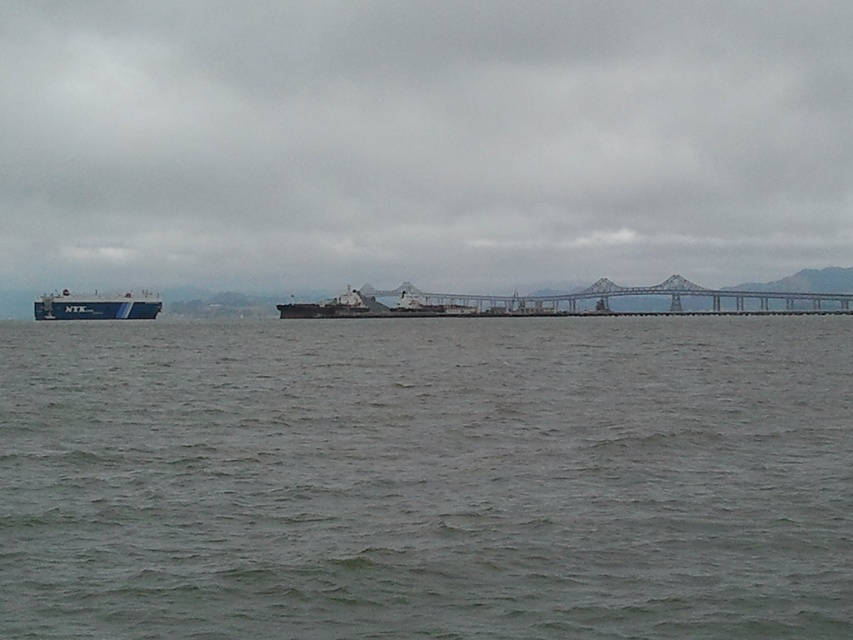
Who is higher up, gray matte water at center or metallic gray bridge at center?

metallic gray bridge at center is above.

Can you confirm if gray matte water at center is positioned below metallic gray bridge at center?

Correct, gray matte water at center is located below metallic gray bridge at center.

Describe the element at coordinates (427, 477) in the screenshot. I see `gray matte water at center` at that location.

This screenshot has height=640, width=853. Find the location of `gray matte water at center`. gray matte water at center is located at coordinates (427, 477).

Is point (454, 301) farther from camera compared to point (149, 314)?

That is True.

Between point (833, 298) and point (111, 298), which one is positioned behind?

Positioned behind is point (833, 298).

Where is `metallic gray bridge at center`? This screenshot has width=853, height=640. metallic gray bridge at center is located at coordinates (619, 296).

Who is positioned more to the right, gray matte water at center or blue matte cargo ship at left?

From the viewer's perspective, gray matte water at center appears more on the right side.

The width and height of the screenshot is (853, 640). What are the coordinates of `gray matte water at center` in the screenshot? It's located at (427, 477).